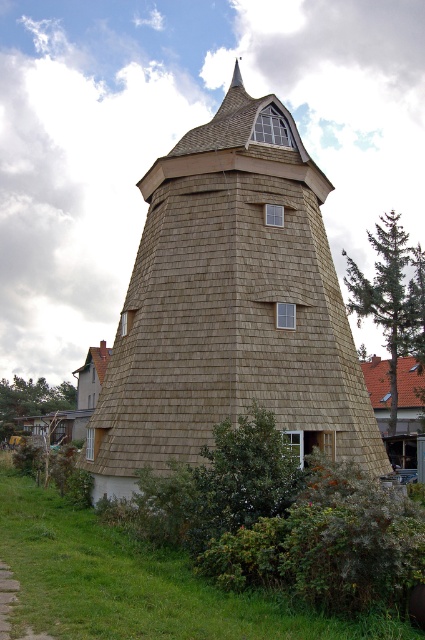
Question: Which object appears farthest from the camera in this image?

Choices:
 (A) brown shingles at upper right
 (B) wooden shingle tower at center

Answer: (A)

Question: Can you confirm if wooden shingle tower at center is positioned below brown shingles at upper right?

Choices:
 (A) no
 (B) yes

Answer: (A)

Question: Is wooden shingle tower at center smaller than brown shingles at upper right?

Choices:
 (A) yes
 (B) no

Answer: (B)

Question: Does wooden shingle tower at center lie in front of brown shingles at upper right?

Choices:
 (A) yes
 (B) no

Answer: (A)

Question: Which point is closer to the camera?

Choices:
 (A) wooden shingle tower at center
 (B) brown shingles at upper right

Answer: (A)